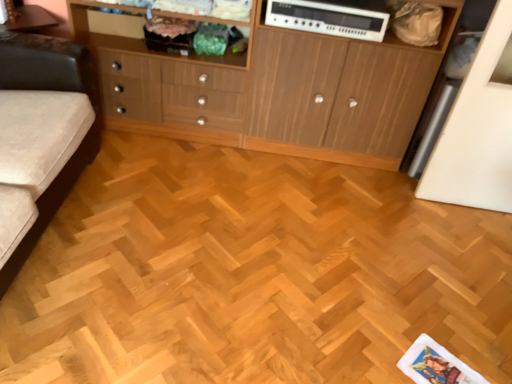
The width and height of the screenshot is (512, 384). Find the location of `wooden cabinet at center`. wooden cabinet at center is located at coordinates (336, 97).

This screenshot has width=512, height=384. What do you see at coordinates (252, 274) in the screenshot?
I see `light brown wood parquet floor at center` at bounding box center [252, 274].

Measure the distance between light brown wood parquet floor at center and camera.

light brown wood parquet floor at center and camera are 4.56 feet apart.

Identify the location of white plastic stereo at upper center. This screenshot has width=512, height=384. (327, 19).

Considering the sizes of objects white plastic stereo at upper center and wooden cabinet at center in the image provided, who is wider, white plastic stereo at upper center or wooden cabinet at center?

wooden cabinet at center is wider.

How many degrees apart are the facing directions of white plastic stereo at upper center and wooden cabinet at center?

The angle between the facing direction of white plastic stereo at upper center and the facing direction of wooden cabinet at center is 0.455 degrees.

Is white plastic stereo at upper center oriented towards wooden cabinet at center?

Yes, white plastic stereo at upper center is aimed at wooden cabinet at center.

Based on the photo, from a real-world perspective, is white plastic stereo at upper center positioned under wooden cabinet at center based on gravity?

No.

Based on their sizes in the image, would you say wooden cabinet at center is bigger or smaller than wooden cabinet at left?

In the image, wooden cabinet at center appears to be larger than wooden cabinet at left.

Is wooden cabinet at center positioned beyond the bounds of wooden cabinet at left?

Yes, wooden cabinet at center is located beyond the bounds of wooden cabinet at left.

Considering the positions of objects wooden cabinet at center and wooden cabinet at left in the image provided, who is more to the right, wooden cabinet at center or wooden cabinet at left?

Positioned to the right is wooden cabinet at center.

Considering the positions of objects white plastic stereo at upper center and light brown wood parquet floor at center in the image provided, who is more to the left, white plastic stereo at upper center or light brown wood parquet floor at center?

From the viewer's perspective, light brown wood parquet floor at center appears more on the left side.

Is white plastic stereo at upper center touching light brown wood parquet floor at center?

There is a gap between white plastic stereo at upper center and light brown wood parquet floor at center.

Which point is more distant from viewer, (353,28) or (160,153)?

The point (160,153) is farther from the camera.

Between white plastic stereo at upper center and light brown wood parquet floor at center, which one has less height?

light brown wood parquet floor at center is shorter.

Looking at this image, considering the sizes of white plastic stereo at upper center and wooden cabinet at left in the image, is white plastic stereo at upper center taller or shorter than wooden cabinet at left?

In the image, white plastic stereo at upper center appears to be shorter than wooden cabinet at left.

You are a GUI agent. You are given a task and a screenshot of the screen. Output one action in this format:
    pyautogui.click(x=<x>, y=<y>)
    Task: Click on the tv cabinet that appears behind the white plastic stereo at upper center
    
    Given the screenshot: What is the action you would take?
    pyautogui.click(x=165, y=86)

From the image's perspective, between white plastic stereo at upper center and wooden cabinet at left, who is located below?

wooden cabinet at left.

Between white plastic stereo at upper center and wooden cabinet at left, which one has larger size?

With larger size is wooden cabinet at left.

Considering the sizes of wooden cabinet at center and light brown wood parquet floor at center in the image, is wooden cabinet at center wider or thinner than light brown wood parquet floor at center?

Considering their sizes, wooden cabinet at center looks slimmer than light brown wood parquet floor at center.

Is wooden cabinet at center taller than light brown wood parquet floor at center?

Yes.

Does wooden cabinet at center appear on the right side of light brown wood parquet floor at center?

Yes, wooden cabinet at center is to the right of light brown wood parquet floor at center.

Considering the positions of point (109, 218) and point (126, 74), is point (109, 218) closer or farther from the camera than point (126, 74)?

Clearly, point (109, 218) is closer to the camera than point (126, 74).

Can you confirm if light brown wood parquet floor at center is smaller than wooden cabinet at left?

Yes, light brown wood parquet floor at center is smaller than wooden cabinet at left.

Does light brown wood parquet floor at center touch wooden cabinet at left?

No, light brown wood parquet floor at center is not making contact with wooden cabinet at left.

Is light brown wood parquet floor at center positioned behind white plastic stereo at upper center?

No, it is in front of white plastic stereo at upper center.

From their relative heights in the image, would you say light brown wood parquet floor at center is taller or shorter than white plastic stereo at upper center?

Clearly, light brown wood parquet floor at center is shorter compared to white plastic stereo at upper center.

From a real-world perspective, is light brown wood parquet floor at center positioned under white plastic stereo at upper center based on gravity?

Yes, from a real-world perspective, light brown wood parquet floor at center is below white plastic stereo at upper center.

Does light brown wood parquet floor at center contain white plastic stereo at upper center?

No, light brown wood parquet floor at center does not contain white plastic stereo at upper center.

Identify the location of cupboard that is on the right side of white plastic stereo at upper center. This screenshot has width=512, height=384. (336, 97).

Where is `tv cabinet lying behind the wooden cabinet at center`? tv cabinet lying behind the wooden cabinet at center is located at coordinates pos(165,86).

Based on their spatial positions, is white plastic stereo at upper center or wooden cabinet at left further from light brown wood parquet floor at center?

Based on the image, white plastic stereo at upper center appears to be further to light brown wood parquet floor at center.

Considering their positions, is white plastic stereo at upper center positioned closer to light brown wood parquet floor at center than wooden cabinet at center?

wooden cabinet at center is positioned closer to the anchor light brown wood parquet floor at center.

Looking at the image, which one is located closer to light brown wood parquet floor at center, wooden cabinet at center or white plastic stereo at upper center?

wooden cabinet at center is closer to light brown wood parquet floor at center.

Considering their positions, is wooden cabinet at left positioned further to light brown wood parquet floor at center than white plastic stereo at upper center?

white plastic stereo at upper center.

When comparing their distances from light brown wood parquet floor at center, does wooden cabinet at center or wooden cabinet at left seem further?

wooden cabinet at left is positioned further to the anchor light brown wood parquet floor at center.

In the scene shown: From the image, which object appears to be nearer to white plastic stereo at upper center, light brown wood parquet floor at center or wooden cabinet at center?

Among the two, wooden cabinet at center is located nearer to white plastic stereo at upper center.

Based on their spatial positions, is wooden cabinet at center or light brown wood parquet floor at center further from wooden cabinet at left?

light brown wood parquet floor at center is positioned further to the anchor wooden cabinet at left.

Which object lies nearer to the anchor point white plastic stereo at upper center, wooden cabinet at left or light brown wood parquet floor at center?

Among the two, wooden cabinet at left is located nearer to white plastic stereo at upper center.

Find the location of a particular element. cupboard between wooden cabinet at left and light brown wood parquet floor at center vertically is located at coordinates (336, 97).

Locate an element on the screen. The height and width of the screenshot is (384, 512). cupboard between white plastic stereo at upper center and light brown wood parquet floor at center in the vertical direction is located at coordinates (336, 97).

I want to click on appliance between wooden cabinet at left and wooden cabinet at center, so click(x=327, y=19).

This screenshot has height=384, width=512. Identify the location of tv cabinet that lies between white plastic stereo at upper center and light brown wood parquet floor at center from top to bottom. (165, 86).